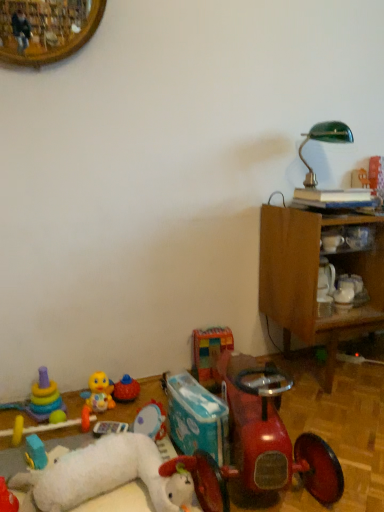
Question: Is point (201, 371) positioned closer to the camera than point (97, 378)?

Choices:
 (A) closer
 (B) farther

Answer: (A)

Question: From the image's perspective, relative to plush yellow duck at lower left, the sixth toy viewed from the right, is multicolored fabric blocks at center, acting as the second toy starting from the right, above or below?

Choices:
 (A) below
 (B) above

Answer: (B)

Question: Estimate the real-world distances between objects in this image. Which object is closer to the green glass table lamp at upper right?

Choices:
 (A) multicolored fabric blocks at center, which appears as the ninth toy when viewed from the left
 (B) rubberized orange ball at center, the 7th toy positioned from the left
 (C) shiny red toy car at lower right
 (D) multicolored plastic stacking rings at lower left, the 7th toy viewed from the right
 (E) rubber duck at lower left, which is the 1th toy in left-to-right order

Answer: (A)

Question: Which of these objects is positioned closest to the wooden shelf at right?

Choices:
 (A) rubberized orange ball at center, which ranks as the fourth toy in right-to-left order
 (B) rubberized red tricycle at lower center, positioned as the 1th toy in right-to-left order
 (C) stacked plastic rings at lower left, which appears as the 2th toy when viewed from the left
 (D) plush white stuffed animal at lower left, acting as the third toy starting from the right
 (E) rubber duck at lower left, which is the 1th toy in left-to-right order

Answer: (B)